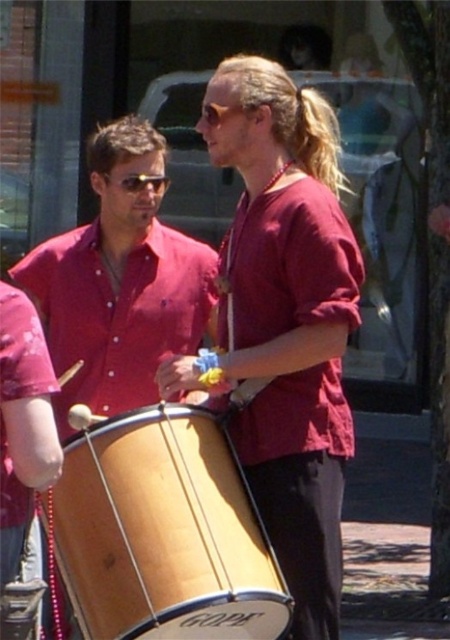
Can you confirm if matte red shirt at center is shorter than sunglasses at left?

No.

Can you confirm if matte red shirt at center is taller than sunglasses at left?

Yes, matte red shirt at center is taller than sunglasses at left.

Is point (255, 352) positioned in front of point (157, 177)?

That is True.

You are a GUI agent. You are given a task and a screenshot of the screen. Output one action in this format:
    pyautogui.click(x=<x>, y=<y>)
    Task: Click on the matte red shirt at center
    
    Given the screenshot: What is the action you would take?
    pyautogui.click(x=284, y=320)

Is wooden drum at center taller than matte wood drum at center?

No.

Between point (153, 506) and point (103, 131), which one is positioned behind?

The point (103, 131) is more distant.

Find the location of a particular element. The image size is (450, 640). wooden drum at center is located at coordinates (162, 532).

Is matte red shirt at center behind matte wood drum at center?

No, it is in front of matte wood drum at center.

Does matte red shirt at center have a lesser height compared to matte wood drum at center?

Incorrect, matte red shirt at center's height does not fall short of matte wood drum at center's.

Does point (316, 483) lie behind point (145, 346)?

No, (316, 483) is closer to viewer.

Locate an element on the screen. matte red shirt at center is located at coordinates (284, 320).